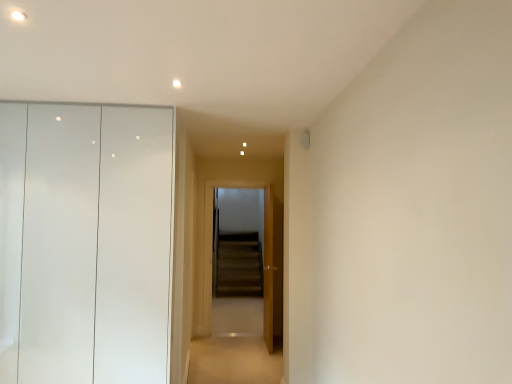
Question: Does wooden screen door at center have a smaller size compared to wooden door at center?

Choices:
 (A) no
 (B) yes

Answer: (B)

Question: From the image's perspective, would you say wooden screen door at center is shown under wooden door at center?

Choices:
 (A) yes
 (B) no

Answer: (B)

Question: Is the depth of wooden screen door at center greater than that of wooden door at center?

Choices:
 (A) yes
 (B) no

Answer: (A)

Question: From a real-world perspective, is wooden screen door at center physically above wooden door at center?

Choices:
 (A) yes
 (B) no

Answer: (A)

Question: From a real-world perspective, is wooden screen door at center physically below wooden door at center?

Choices:
 (A) no
 (B) yes

Answer: (A)

Question: Is point (82, 160) closer or farther from the camera than point (202, 340)?

Choices:
 (A) closer
 (B) farther

Answer: (A)

Question: In terms of width, does matte white dresser at left look wider or thinner when compared to carpeted floor at center?

Choices:
 (A) thin
 (B) wide

Answer: (A)

Question: From the image's perspective, is matte white dresser at left positioned above or below carpeted floor at center?

Choices:
 (A) above
 (B) below

Answer: (A)

Question: From a real-world perspective, is matte white dresser at left physically located above or below carpeted floor at center?

Choices:
 (A) above
 (B) below

Answer: (A)

Question: From the image's perspective, relative to matte white dresser at left, is carpeted floor at center above or below?

Choices:
 (A) above
 (B) below

Answer: (B)

Question: Relative to matte white dresser at left, is carpeted floor at center in front or behind?

Choices:
 (A) behind
 (B) front

Answer: (A)

Question: From their relative heights in the image, would you say carpeted floor at center is taller or shorter than matte white dresser at left?

Choices:
 (A) short
 (B) tall

Answer: (A)

Question: Is carpeted floor at center wider or thinner than matte white dresser at left?

Choices:
 (A) thin
 (B) wide

Answer: (B)

Question: From their relative heights in the image, would you say wooden door at center is taller or shorter than matte white dresser at left?

Choices:
 (A) short
 (B) tall

Answer: (A)

Question: From a real-world perspective, is wooden door at center above or below matte white dresser at left?

Choices:
 (A) above
 (B) below

Answer: (B)